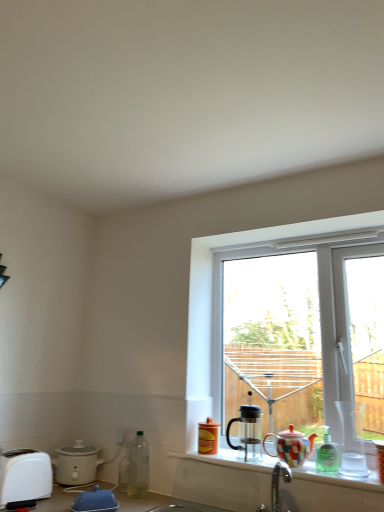
Question: From the image's perspective, is multicolored ceramic coffee cup at right, which is the first coffee cup in right-to-left order, located above or below green translucent bottle at lower right, the third bottle viewed from the left?

Choices:
 (A) below
 (B) above

Answer: (B)

Question: Would you say multicolored ceramic coffee cup at right, which is the first coffee cup in right-to-left order, is inside or outside green translucent bottle at lower right, the third bottle viewed from the left?

Choices:
 (A) inside
 (B) outside

Answer: (B)

Question: Considering the real-world distances, which object is farthest from the clear plastic bottle at lower left, which ranks as the third bottle in right-to-left order?

Choices:
 (A) white glossy counter top at lower center
 (B) multicolored ceramic teapot at window
 (C) multicolored ceramic coffee cup at right, the 3th coffee cup positioned from the left
 (D) blue rubber duck at lower left
 (E) transparent plastic window at center

Answer: (C)

Question: Which object is positioned closest to the orange matte bottle at window, placed as the 2th bottle when sorted from left to right?

Choices:
 (A) multicolored ceramic coffee cup at right, the 3th coffee cup positioned from the left
 (B) transparent glass coffee pot at window, marked as the first coffee cup in a left-to-right arrangement
 (C) blue rubber duck at lower left
 (D) translucent glass coffee cup at right, which is the 2th coffee cup from right to left
 (E) clear plastic bottle at lower left, the 1th bottle when ordered from left to right

Answer: (B)